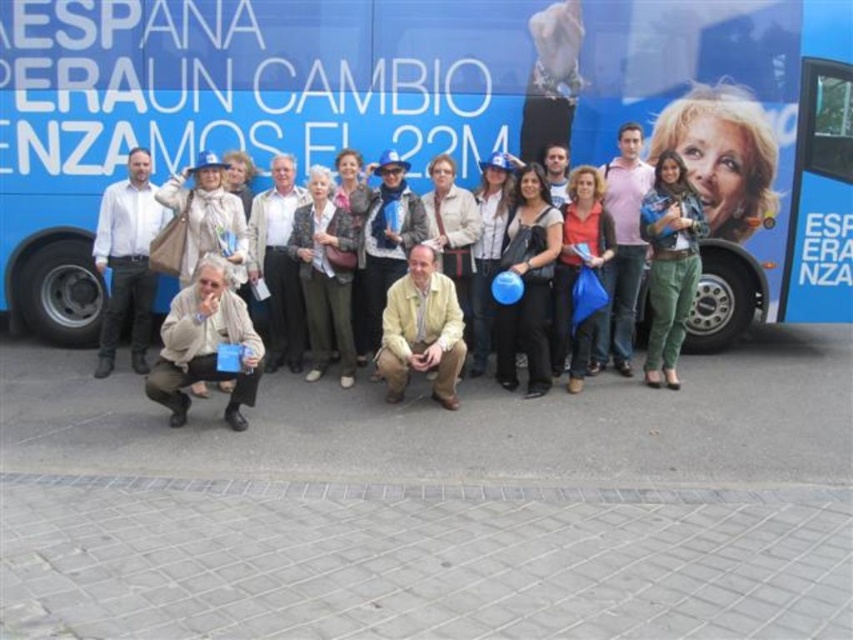
Question: Does black matte dress at center appear over metallic blue jacket at center?

Choices:
 (A) no
 (B) yes

Answer: (A)

Question: Which is farther from the metallic blue jacket at center?

Choices:
 (A) white shirt at left
 (B) blue matte bus at center
 (C) yellow textured jacket at center
 (D) green textured pants at center

Answer: (A)

Question: Which point is closer to the camera?

Choices:
 (A) (210, 365)
 (B) (680, 237)
 (C) (541, 371)
 (D) (448, 332)

Answer: (A)

Question: Considering the real-world distances, which object is farthest from the green textured pants at center?

Choices:
 (A) blue matte bus at center
 (B) yellow textured jacket at center
 (C) metallic blue jacket at center
 (D) matte red shirt at center

Answer: (C)

Question: Does light beige sweater at center appear over pink cotton shirt at center?

Choices:
 (A) no
 (B) yes

Answer: (A)

Question: Is blue matte bus at center thinner than yellow textured jacket at center?

Choices:
 (A) no
 (B) yes

Answer: (A)